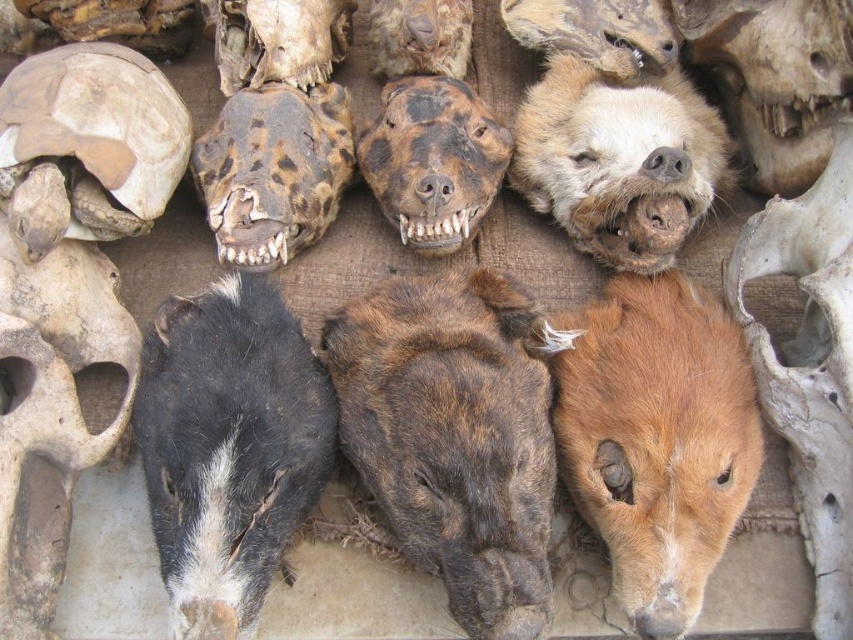
You are an anthropologist examining this display of animal skulls and heads. You need to determine the spatial relationship between the brown furry animal at lower right and the brown textured tortoise shell at upper left. Which one is closer to the viewer?

The brown furry animal at lower right is closer to the viewer as it is positioned in front of the brown textured tortoise shell at upper left.